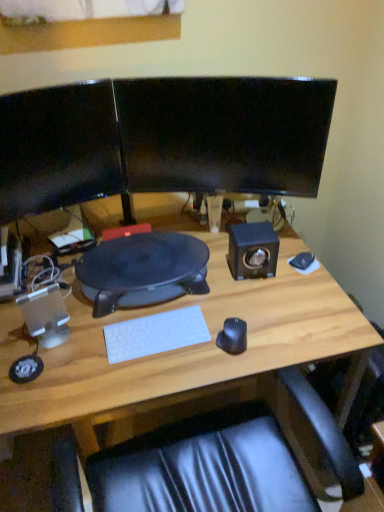
Where is `space that is in front of black rubberized desk at center`? Image resolution: width=384 pixels, height=512 pixels. space that is in front of black rubberized desk at center is located at coordinates (125, 359).